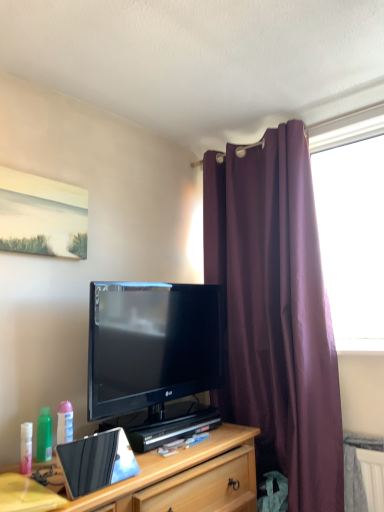
Question: Relative to wooden cabinet at lower center, is black glossy tv at center in front or behind?

Choices:
 (A) front
 (B) behind

Answer: (B)

Question: Does point (115, 352) appear closer or farther from the camera than point (87, 499)?

Choices:
 (A) closer
 (B) farther

Answer: (B)

Question: Estimate the real-world distances between objects in this image. Which object is closer to the black glossy tv at center?

Choices:
 (A) green matte spray bottle at lower left
 (B) metallic silver laptop at center
 (C) purple fabric curtain at right
 (D) wooden cabinet at lower center
 (E) yellow matte desk at lower left

Answer: (D)

Question: Which object is the closest to the wooden cabinet at lower center?

Choices:
 (A) green matte spray bottle at lower left
 (B) yellow matte desk at lower left
 (C) metallic silver laptop at center
 (D) black glossy tv at center
 (E) purple fabric curtain at right

Answer: (C)